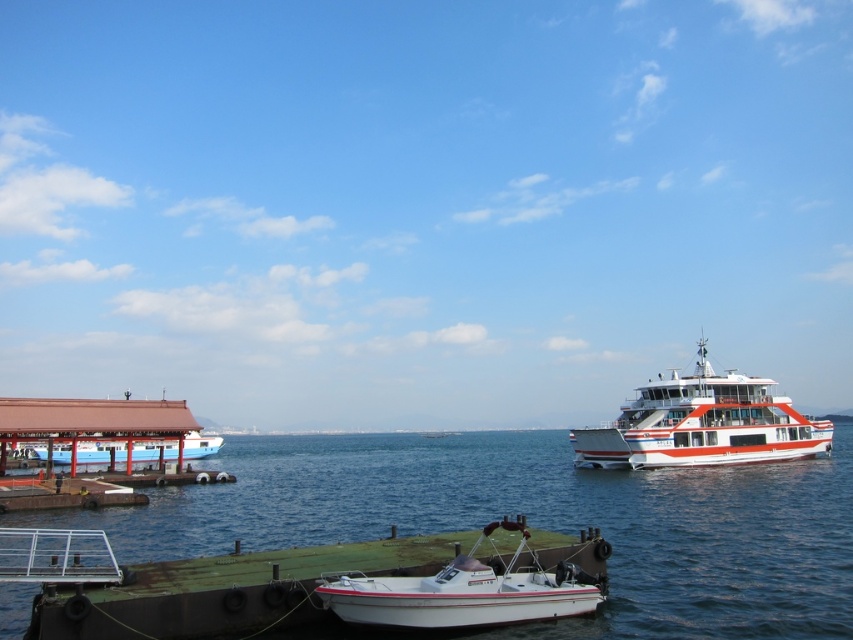
Describe the element at coordinates (538, 522) in the screenshot. This screenshot has height=640, width=853. I see `green matte water at lower left` at that location.

Does green matte water at lower left have a greater height compared to light blue wooden dock at left?

Correct, green matte water at lower left is much taller as light blue wooden dock at left.

This screenshot has width=853, height=640. Find the location of `green matte water at lower left`. green matte water at lower left is located at coordinates (538, 522).

Which is behind, point (624, 432) or point (138, 445)?

The point (138, 445) is behind.

Does white glossy ferry at right appear on the left side of light blue wooden dock at left?

Incorrect, white glossy ferry at right is not on the left side of light blue wooden dock at left.

Is point (775, 392) positioned behind point (169, 451)?

That is False.

You are a GUI agent. You are given a task and a screenshot of the screen. Output one action in this format:
    pyautogui.click(x=<x>, y=<y>)
    Task: Click on the white glossy ferry at right
    Image resolution: width=853 pixels, height=640 pixels.
    Given the screenshot: What is the action you would take?
    point(701,424)

Is point (587, 493) closer to camera compared to point (343, 616)?

No, it is not.

Measure the distance from green matte water at lower left to white glossy boat at center.

Result: green matte water at lower left is 69.87 meters away from white glossy boat at center.

Which is behind, point (711, 577) or point (314, 589)?

Positioned behind is point (711, 577).

The image size is (853, 640). What are the coordinates of `green matte water at lower left` in the screenshot? It's located at (538, 522).